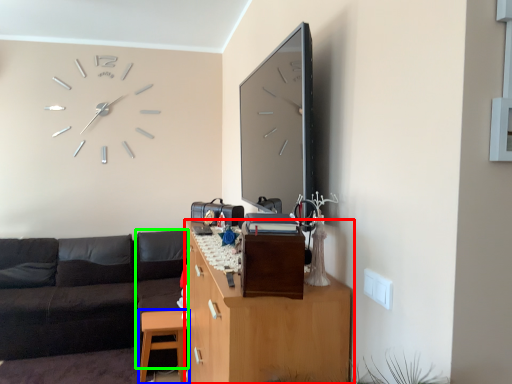
Question: Which object is the closest to the cabinetry (highlighted by a red box)? Choose among these: table (highlighted by a blue box) or couch (highlighted by a green box).

Choices:
 (A) table
 (B) couch

Answer: (A)